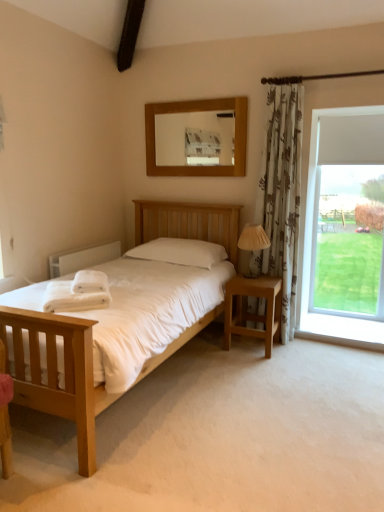
This screenshot has width=384, height=512. Describe the element at coordinates (90, 282) in the screenshot. I see `white soft towels at left` at that location.

What is the approximate height of white painted radiator at left?

white painted radiator at left is 8.26 inches tall.

Describe the element at coordinates (57, 375) in the screenshot. I see `light wood bed at center` at that location.

The width and height of the screenshot is (384, 512). Describe the element at coordinates (253, 238) in the screenshot. I see `beige fabric lampshade at right` at that location.

What do you see at coordinates (316, 77) in the screenshot? I see `brown fabric curtain at upper right` at bounding box center [316, 77].

Identify the location of brown fabric curtain at upper right. This screenshot has height=512, width=384. (316, 77).

The height and width of the screenshot is (512, 384). What are the coordinates of `white soft towels at left` in the screenshot? It's located at (90, 282).

From the image's perspective, which one is positioned higher, wooden mirror at upper center or beige fabric lampshade at right?

wooden mirror at upper center, from the image's perspective.

Does wooden mirror at upper center appear on the left side of beige fabric lampshade at right?

Yes, wooden mirror at upper center is to the left of beige fabric lampshade at right.

Based on their sizes in the image, would you say wooden mirror at upper center is bigger or smaller than beige fabric lampshade at right?

In the image, wooden mirror at upper center appears to be larger than beige fabric lampshade at right.

Is white painted radiator at left at the right side of light wood bed at center?

Incorrect, white painted radiator at left is not on the right side of light wood bed at center.

Is white painted radiator at left taller or shorter than light wood bed at center?

Clearly, white painted radiator at left is shorter compared to light wood bed at center.

Between point (79, 263) and point (176, 349), which one is positioned in front?

The point (176, 349) is more forward.

Would you consider white painted radiator at left to be distant from light wood bed at center?

Yes, white painted radiator at left and light wood bed at center are quite far apart.

Which is more distant, [258,331] or [323,334]?

The point [323,334] is farther.

Is wooden nightstand at right to the left or to the right of transparent glass window at right in the image?

Based on their positions, wooden nightstand at right is located to the left of transparent glass window at right.

Looking at this image, how many degrees apart are the facing directions of wooden nightstand at right and transparent glass window at right?

The facing directions of wooden nightstand at right and transparent glass window at right are 0.979 degrees apart.

Is beige fabric lampshade at right placed right next to brown fabric curtain at upper right?

No.

Can you confirm if beige fabric lampshade at right is positioned to the left of brown fabric curtain at upper right?

Yes.

Considering the relative sizes of beige fabric lampshade at right and brown fabric curtain at upper right in the image provided, is beige fabric lampshade at right taller than brown fabric curtain at upper right?

Yes, beige fabric lampshade at right is taller than brown fabric curtain at upper right.

Considering the points (252, 243) and (367, 73), which point is behind, point (252, 243) or point (367, 73)?

The point (252, 243) is more distant.

Can you tell me how much white soft towels at left and wooden nightstand at right differ in facing direction?

119 degrees separate the facing orientations of white soft towels at left and wooden nightstand at right.

Is point (87, 288) in front of point (248, 286)?

Yes, point (87, 288) is in front of point (248, 286).

Can you confirm if white soft towels at left is bigger than wooden nightstand at right?

No, white soft towels at left is not bigger than wooden nightstand at right.

Is white soft towels at left oriented towards wooden nightstand at right?

No, white soft towels at left does not turn towards wooden nightstand at right.

Based on their sizes in the image, would you say brown fabric curtain at upper right is bigger or smaller than transparent glass window at right?

Clearly, brown fabric curtain at upper right is smaller in size than transparent glass window at right.

Is brown fabric curtain at upper right oriented towards transparent glass window at right?

No, brown fabric curtain at upper right is not aimed at transparent glass window at right.

Is brown fabric curtain at upper right located outside transparent glass window at right?

Absolutely, brown fabric curtain at upper right is external to transparent glass window at right.

Does beige fabric lampshade at right lie in front of white painted radiator at left?

No, it is behind white painted radiator at left.

What's the angular difference between beige fabric lampshade at right and white painted radiator at left's facing directions?

93.2 degrees separate the facing orientations of beige fabric lampshade at right and white painted radiator at left.

Is beige fabric lampshade at right far away from white painted radiator at left?

Absolutely, beige fabric lampshade at right is distant from white painted radiator at left.

Locate an element on the screen. Image resolution: width=384 pixels, height=512 pixels. mirror above the beige fabric lampshade at right (from the image's perspective) is located at coordinates (197, 138).

The image size is (384, 512). I want to click on radiator located behind the light wood bed at center, so click(82, 259).

Looking at the image, which one is located further to wooden mirror at upper center, transparent glass window at right or white painted radiator at left?

transparent glass window at right lies further to wooden mirror at upper center than the other object.

Looking at the image, which one is located closer to white soft towels at left, wooden mirror at upper center or beige fabric lampshade at right?

beige fabric lampshade at right lies closer to white soft towels at left than the other object.

When comparing their distances from white soft towels at left, does white soft towel at lower left or brown fabric curtain at upper right seem further?

brown fabric curtain at upper right is further to white soft towels at left.

Which object lies nearer to the anchor point transparent glass window at right, beige fabric lampshade at right or light wood bed at center?

beige fabric lampshade at right lies closer to transparent glass window at right than the other object.

From the image, which object appears to be nearer to wooden mirror at upper center, brown fabric curtain at upper right or white painted radiator at left?

Among the two, brown fabric curtain at upper right is located nearer to wooden mirror at upper center.

When comparing their distances from transparent glass window at right, does light wood bed at center or white soft towel at lower left seem closer?

white soft towel at lower left.

Considering their positions, is brown fabric curtain at upper right positioned further to white painted radiator at left than wooden nightstand at right?

brown fabric curtain at upper right is further to white painted radiator at left.

Which object lies nearer to the anchor point white painted radiator at left, transparent glass window at right or beige fabric lampshade at right?

Based on the image, beige fabric lampshade at right appears to be nearer to white painted radiator at left.

Identify the location of window between brown fabric curtain at upper right and wooden nightstand at right in the vertical direction. (311, 248).

Locate an element on the screen. cloth between brown fabric curtain at upper right and light wood bed at center vertically is located at coordinates (90, 282).

Where is `lamp between white soft towel at lower left and brown fabric curtain at upper right in the horizontal direction`? Image resolution: width=384 pixels, height=512 pixels. lamp between white soft towel at lower left and brown fabric curtain at upper right in the horizontal direction is located at coordinates (253, 238).

This screenshot has width=384, height=512. I want to click on blanket located between light wood bed at center and white painted radiator at left in the depth direction, so click(78, 293).